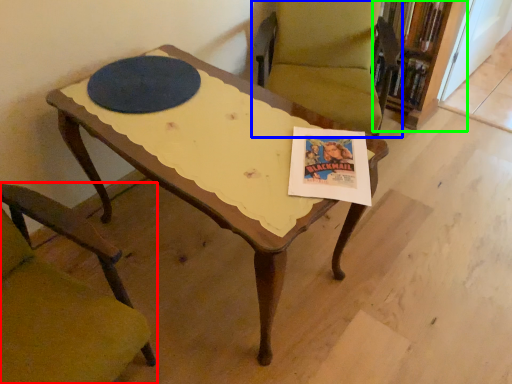
Question: Which object is positioned farthest from chair (highlighted by a red box)? Select from chair (highlighted by a blue box) and bookcase (highlighted by a green box).

Choices:
 (A) chair
 (B) bookcase

Answer: (B)